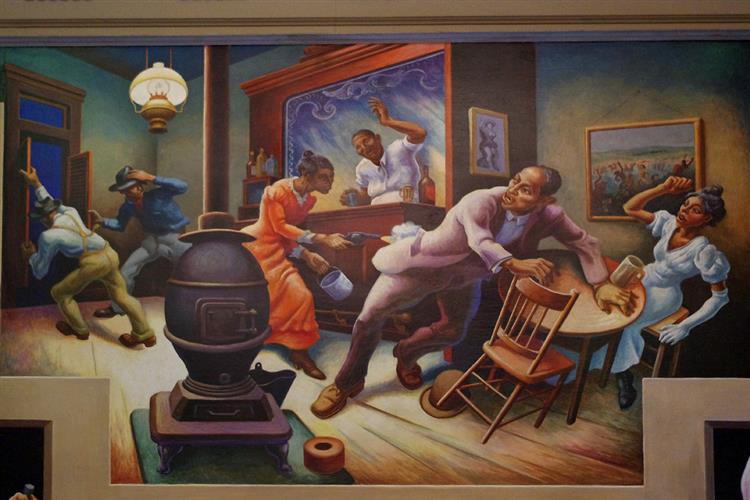
Image resolution: width=750 pixels, height=500 pixels. Find the location of `stove`. stove is located at coordinates (220, 311).